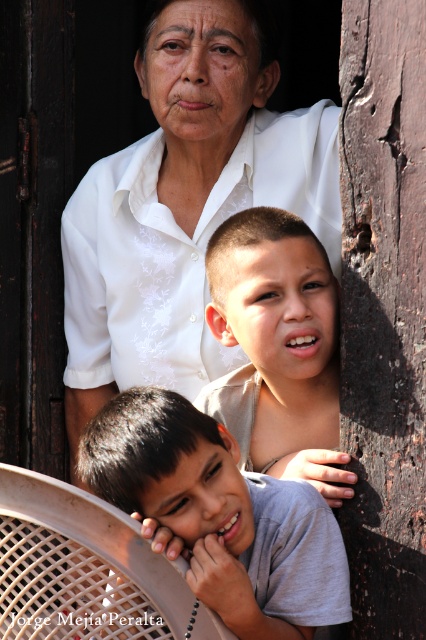
Between white textured shirt at upper center and gray cotton shirt at lower left, which one has more height?

With more height is white textured shirt at upper center.

Image resolution: width=426 pixels, height=640 pixels. I want to click on white textured shirt at upper center, so click(x=184, y=204).

Identify the location of white textured shirt at upper center. The height and width of the screenshot is (640, 426). (184, 204).

In the scene shown: Is gray cotton shirt at lower left further to camera compared to smooth beige shirt at center?

No.

Can you confirm if gray cotton shirt at lower left is wider than smooth beige shirt at center?

Indeed, gray cotton shirt at lower left has a greater width compared to smooth beige shirt at center.

Image resolution: width=426 pixels, height=640 pixels. In order to click on gray cotton shirt at lower left in this screenshot , I will do `click(221, 515)`.

Who is more forward, (69,392) or (313,468)?

Point (313,468) is in front.

Is point (137, 147) closer to camera compared to point (282, 368)?

That is False.

Is point (152, 36) farther from viewer compared to point (247, 340)?

Yes.

You are a GUI agent. You are given a task and a screenshot of the screen. Output one action in this format:
    pyautogui.click(x=<x>, y=<y>)
    Task: Click on the white textured shirt at upper center
    
    Given the screenshot: What is the action you would take?
    pyautogui.click(x=184, y=204)